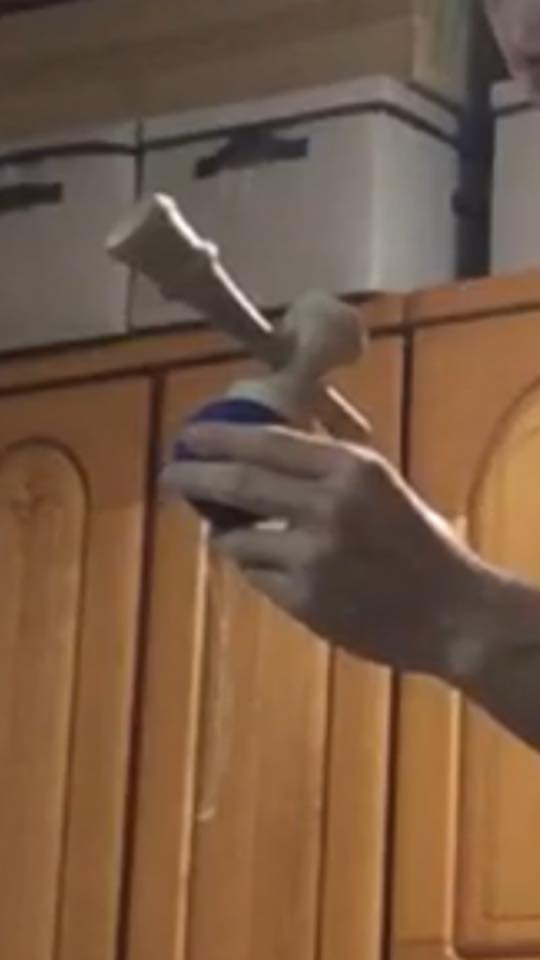
What are the coordinates of `peg` in the screenshot? It's located at point(330,400).